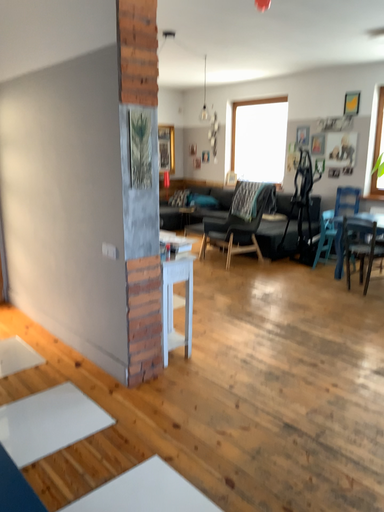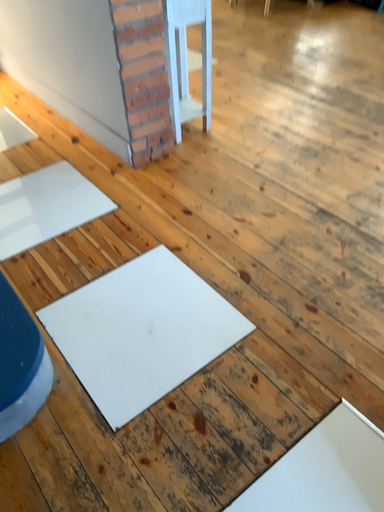
Question: Which way did the camera rotate in the video?

Choices:
 (A) rotated upward
 (B) rotated downward

Answer: (B)